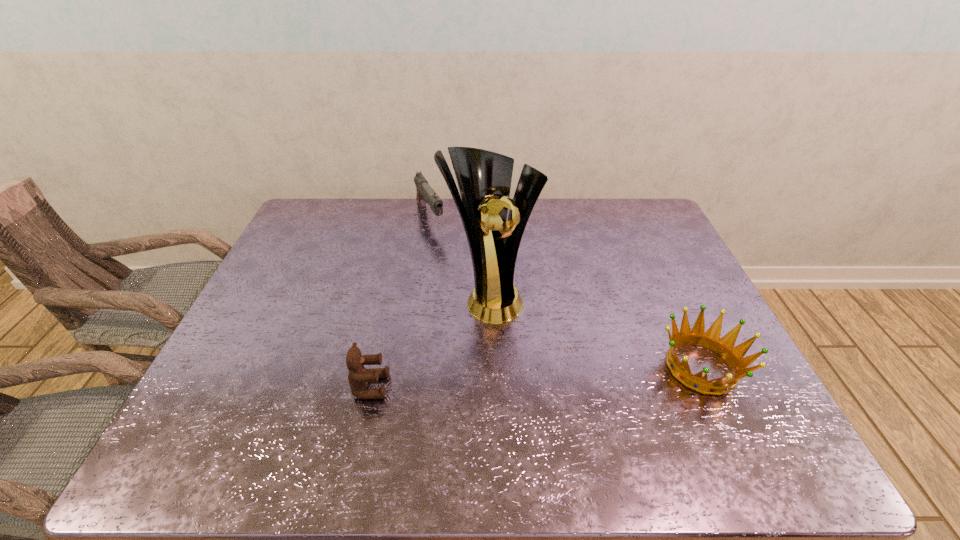
This screenshot has height=540, width=960. What are the coordinates of `vacant space located in the direction the farthest object is aimed` in the screenshot? It's located at (451, 261).

The image size is (960, 540). Find the location of `free space located at the front of the tallest object, where the globe is visible`. free space located at the front of the tallest object, where the globe is visible is located at coordinates (536, 353).

I want to click on free location located 0.250m at the front of the tallest object, where the globe is visible, so click(x=564, y=394).

Locate an element on the screen. The height and width of the screenshot is (540, 960). free space located at the front of the tallest object, where the globe is visible is located at coordinates (524, 336).

The height and width of the screenshot is (540, 960). I want to click on object at the far edge, so click(x=425, y=194).

At what (x,y) coordinates should I click in order to perform the action: click on teddy bear situated at the near edge. Please return your answer as a coordinate pair (x, y). Looking at the image, I should click on (358, 376).

The width and height of the screenshot is (960, 540). In order to click on crown that is at the near edge in this screenshot , I will do `click(711, 339)`.

Where is `object at the right edge`? This screenshot has width=960, height=540. object at the right edge is located at coordinates (711, 339).

At what (x,y) coordinates should I click in order to perform the action: click on object situated at the near right corner. Please return your answer as a coordinate pair (x, y). This screenshot has height=540, width=960. Looking at the image, I should click on (711, 339).

Locate an element on the screen. free region at the far edge of the desktop is located at coordinates (458, 210).